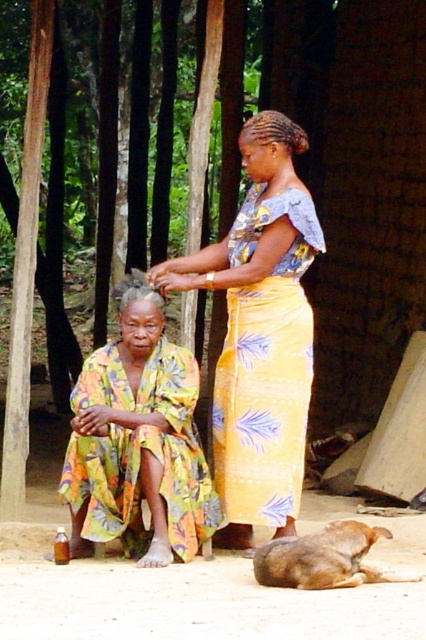
You are a photographer trying to capture a photo of the printed fabric dress at center and the brown fur dog at lower right. The camera you are using has a minimum focus distance of 1 meter. Will you be able to focus on both subjects simultaneously?

The printed fabric dress at center is 1.13 meters from the brown fur dog at lower right. Since the distance between them is greater than the camera minimum focus distance of 1 meter, the camera can focus on both subjects simultaneously.

You are a photographer trying to capture a photo of the printed fabric dress at center and the brown fur dog at lower right. You want to ensure both subjects are in focus. Since the dog is behind the dress, will you need to adjust your camera focus to include the dog in the shot?

The brown fur dog at lower right is behind the printed fabric dress at center, so if you focus on the dress, the dog will also be in focus as they are on the same focal plane.